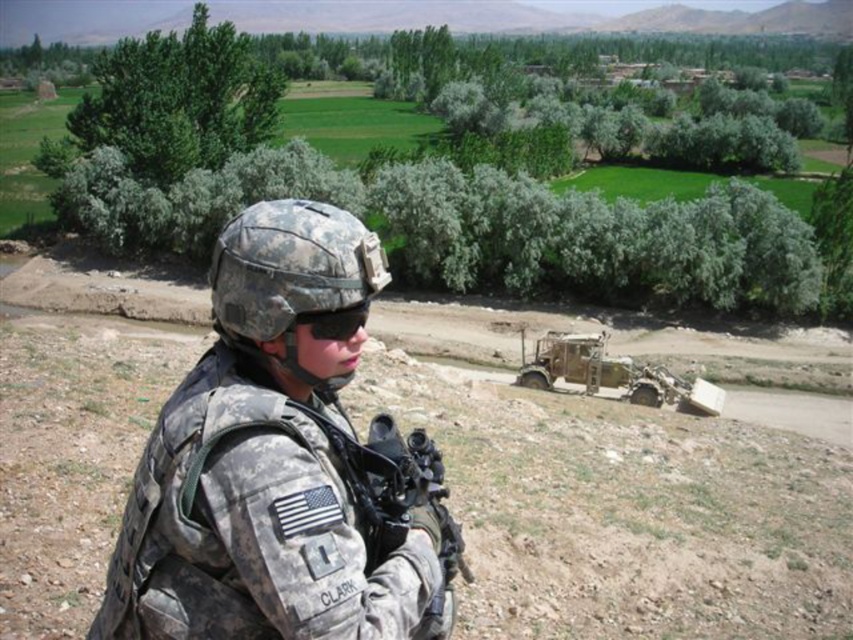
You are a drone operator controlling a drone that needs to land at point (x=122, y=76). The drone has a maximum landing range of 60 meters. Can the drone safely land at that point?

The point (x=122, y=76) is 62.36 meters from the viewer, which exceeds the drone operator control range of 60 meters. The drone cannot safely land there.

You are a drone operator controlling a drone that needs to hover exactly at the point marked as point (x=375, y=252). The drone has a maximum hover distance of 10 feet from the camera. Can the drone safely hover at that point?

The point (x=375, y=252) is 8.69 feet away from the camera, which is within the drone operator drone maximum hover distance of 10 feet. Therefore, the drone can safely hover at that point.